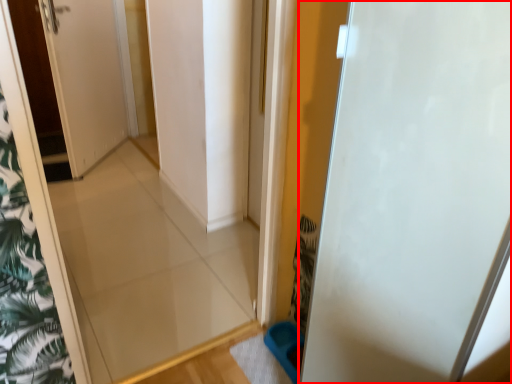
Question: Considering the relative positions of door (annotated by the red box) and door in the image provided, where is door (annotated by the red box) located with respect to the staircase?

Choices:
 (A) right
 (B) left

Answer: (A)